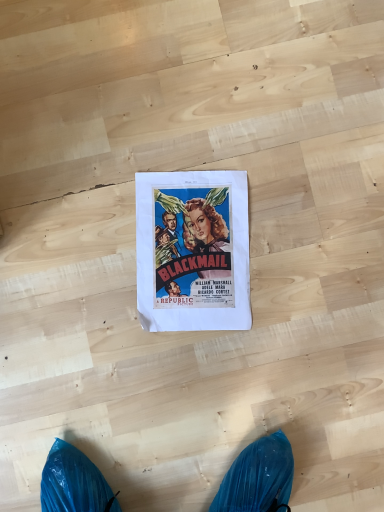
Image resolution: width=384 pixels, height=512 pixels. I want to click on vacant region under matte paper poster at center (from a real-world perspective), so click(x=197, y=248).